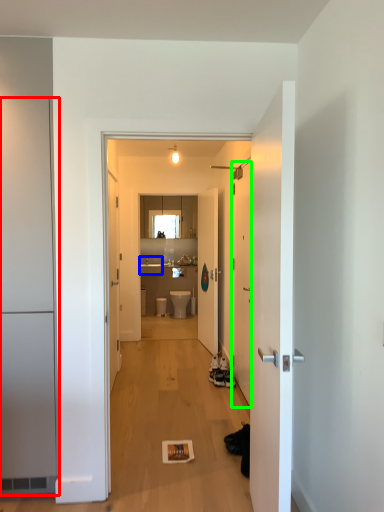
Question: Considering the real-world distances, which object is closest to door (highlighted by a red box)? sink (highlighted by a blue box) or door (highlighted by a green box).

Choices:
 (A) sink
 (B) door

Answer: (B)